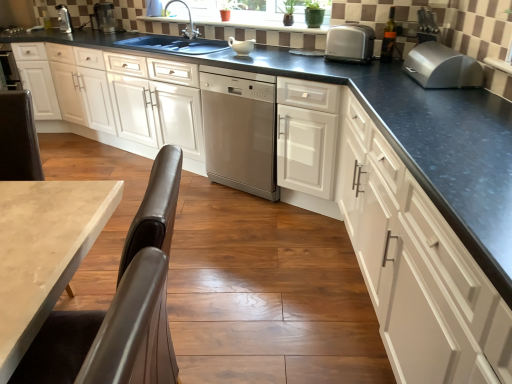
Question: Are metal toaster at upper left, acting as the first appliance starting from the left, and metallic silver blender at upper left, which appears as the 1th appliance when viewed from the right, far apart?

Choices:
 (A) yes
 (B) no

Answer: (B)

Question: From a real-world perspective, is metal toaster at upper left, acting as the first appliance starting from the left, over metallic silver blender at upper left, which appears as the 1th appliance when viewed from the right?

Choices:
 (A) yes
 (B) no

Answer: (B)

Question: From a real-world perspective, is metal toaster at upper left, acting as the first appliance starting from the left, beneath metallic silver blender at upper left, which appears as the 1th appliance when viewed from the right?

Choices:
 (A) yes
 (B) no

Answer: (A)

Question: From the image's perspective, is metal toaster at upper left, acting as the first appliance starting from the left, on top of metallic silver blender at upper left, placed as the 2th appliance when sorted from left to right?

Choices:
 (A) no
 (B) yes

Answer: (B)

Question: Is metal toaster at upper left, which appears as the second appliance when viewed from the right, positioned behind metallic silver blender at upper left, which appears as the 1th appliance when viewed from the right?

Choices:
 (A) no
 (B) yes

Answer: (B)

Question: Would you say metal toaster at upper left, which appears as the second appliance when viewed from the right, is outside metallic silver blender at upper left, placed as the 2th appliance when sorted from left to right?

Choices:
 (A) no
 (B) yes

Answer: (B)

Question: Is white glossy cabinet at center, arranged as the 2th cabinetry when viewed from the left, a part of metallic silver blender at upper left, which appears as the 1th appliance when viewed from the right?

Choices:
 (A) no
 (B) yes

Answer: (A)

Question: From a real-world perspective, is metallic silver blender at upper left, placed as the 2th appliance when sorted from left to right, beneath white glossy cabinet at center, arranged as the 2th cabinetry when viewed from the left?

Choices:
 (A) no
 (B) yes

Answer: (A)

Question: Can you confirm if metallic silver blender at upper left, which appears as the 1th appliance when viewed from the right, is positioned to the left of white glossy cabinet at center, acting as the second cabinetry starting from the right?

Choices:
 (A) yes
 (B) no

Answer: (A)

Question: Can you confirm if metallic silver blender at upper left, which appears as the 1th appliance when viewed from the right, is shorter than white glossy cabinet at center, acting as the second cabinetry starting from the right?

Choices:
 (A) yes
 (B) no

Answer: (A)

Question: Does metallic silver blender at upper left, placed as the 2th appliance when sorted from left to right, have a larger size compared to white glossy cabinet at center, acting as the second cabinetry starting from the right?

Choices:
 (A) no
 (B) yes

Answer: (A)

Question: From a real-world perspective, is metallic silver blender at upper left, placed as the 2th appliance when sorted from left to right, positioned over white glossy cabinet at center, acting as the second cabinetry starting from the right, based on gravity?

Choices:
 (A) no
 (B) yes

Answer: (B)

Question: Considering the relative positions of stainless steel dishwasher at center and satin silver toaster at upper right, the first kitchen appliance from the back, in the image provided, is stainless steel dishwasher at center to the right of satin silver toaster at upper right, the first kitchen appliance from the back, from the viewer's perspective?

Choices:
 (A) no
 (B) yes

Answer: (A)